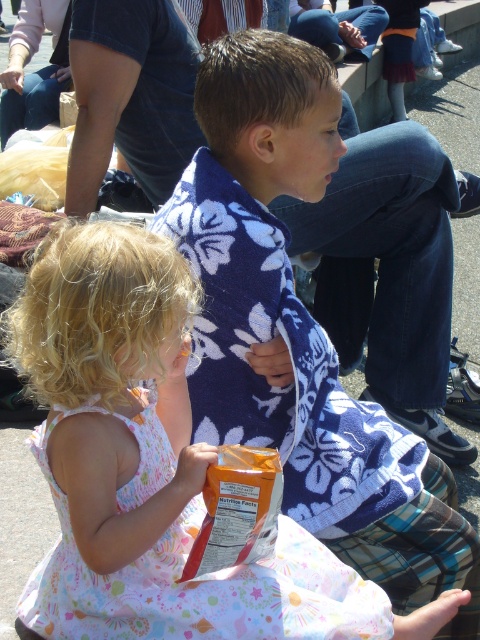
Question: Which of the following is the closest to the observer?

Choices:
 (A) (217, 234)
 (B) (72, 396)

Answer: (B)

Question: Can you confirm if blue floral towel at center is positioned to the right of floral dress at center?

Choices:
 (A) yes
 (B) no

Answer: (A)

Question: Can you confirm if blue floral towel at center is positioned to the left of floral dress at center?

Choices:
 (A) yes
 (B) no

Answer: (B)

Question: Is blue floral towel at center positioned before floral dress at center?

Choices:
 (A) no
 (B) yes

Answer: (A)